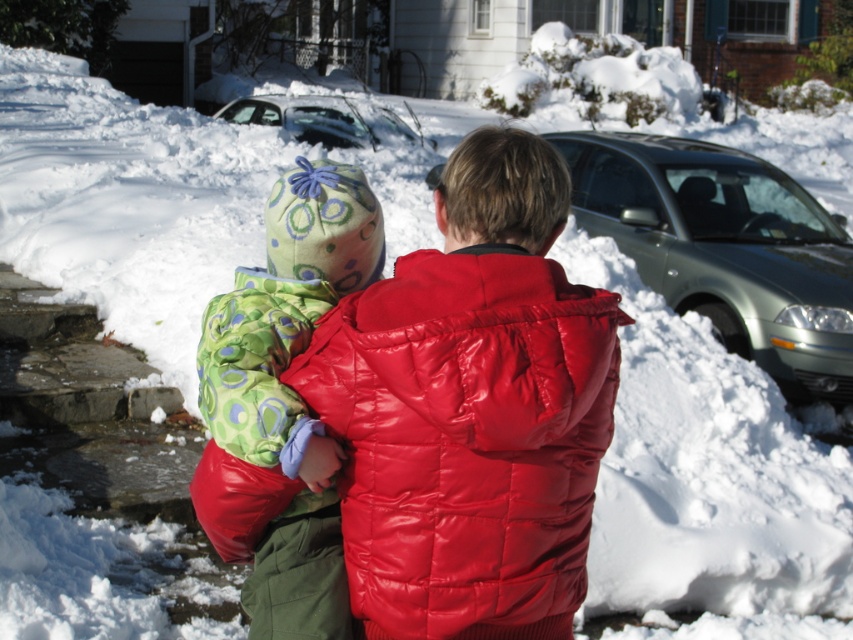
Question: Which of the following is the farthest from the observer?

Choices:
 (A) (438, 252)
 (B) (749, 272)
 (C) (199, 349)

Answer: (B)

Question: Which point is closer to the camera taking this photo?

Choices:
 (A) (254, 336)
 (B) (426, 442)
 (C) (310, 424)
 (D) (758, 157)

Answer: (B)

Question: Among these points, which one is farthest from the camera?

Choices:
 (A) click(234, 115)
 (B) click(432, 470)
 (C) click(795, 180)

Answer: (A)

Question: Can you confirm if shiny red jacket at center is wider than silver metallic sedan at right?

Choices:
 (A) no
 (B) yes

Answer: (A)

Question: Does silver metallic sedan at right have a larger size compared to silver metallic car at upper center?

Choices:
 (A) no
 (B) yes

Answer: (A)

Question: Where is shiny red jacket at center located in relation to green fuzzy coat at center in the image?

Choices:
 (A) left
 (B) right

Answer: (B)